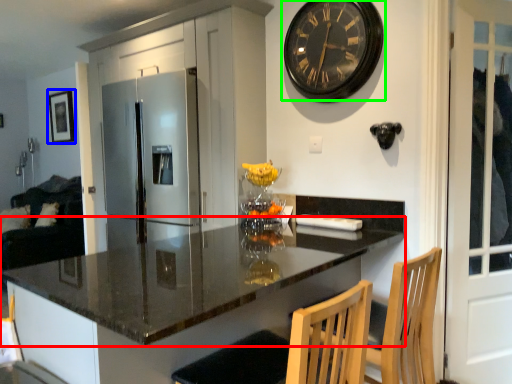
Question: Which object is the closest to the countertop (highlighted by a red box)? Choose among these: picture frame (highlighted by a blue box) or wall clock (highlighted by a green box).

Choices:
 (A) picture frame
 (B) wall clock

Answer: (B)